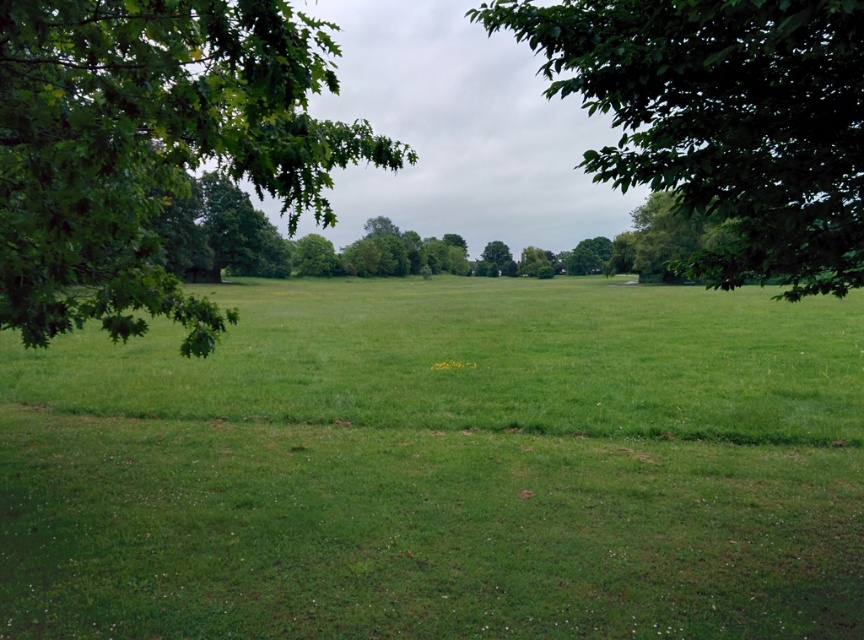
Question: Does green grass at center have a lesser width compared to green leafy tree at center?

Choices:
 (A) yes
 (B) no

Answer: (B)

Question: Which object is the closest to the green leafy tree at upper center?

Choices:
 (A) green grass at center
 (B) green leafy tree at left

Answer: (A)

Question: Which point is closer to the camera?

Choices:
 (A) green grass at center
 (B) green leafy tree at center
 (C) green leafy tree at left

Answer: (C)

Question: Is green leafy tree at left to the left of green leafy tree at upper center from the viewer's perspective?

Choices:
 (A) yes
 (B) no

Answer: (A)

Question: From the image, what is the correct spatial relationship of green leafy tree at left in relation to green leafy tree at center?

Choices:
 (A) below
 (B) above

Answer: (B)

Question: Which is nearer to the green grass at center?

Choices:
 (A) green leafy tree at left
 (B) green leafy tree at center
 (C) green leafy tree at upper center

Answer: (C)